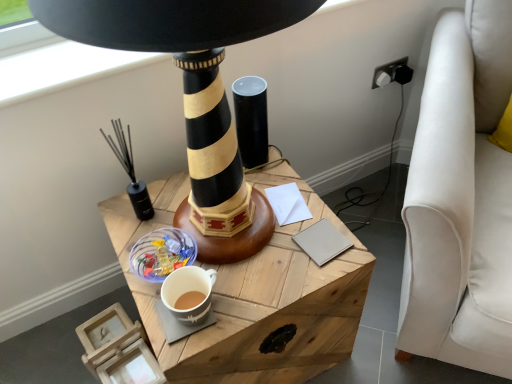
Describe the element at coordinates (392, 73) in the screenshot. I see `black plastic plug at upper right` at that location.

This screenshot has height=384, width=512. Describe the element at coordinates (193, 93) in the screenshot. I see `black matte lighthouse at center` at that location.

Image resolution: width=512 pixels, height=384 pixels. What are the coordinates of `matte black cylinder at center, which ranks as the first candle holder in right-to-left order` in the screenshot? It's located at (251, 120).

What do you see at coordinates (251, 120) in the screenshot?
I see `matte black cylinder at center, which is counted as the 2th candle holder, starting from the left` at bounding box center [251, 120].

Describe the element at coordinates (130, 172) in the screenshot. I see `black matte candle holder at left, which is the 2th candle holder from right to left` at that location.

Measure the distance between point (129, 169) and camera.

Point (129, 169) and camera are 3.30 feet apart from each other.

The image size is (512, 384). Describe the element at coordinates (322, 241) in the screenshot. I see `beige leather notepad at center, placed as the 1th notepad when sorted from front to back` at that location.

Based on the photo, what is the approximate width of wooden table at center?

The width of wooden table at center is 21.47 inches.

Locate an element on the screen. white leather swivel chair at right is located at coordinates (461, 198).

How far apart are matte ceramic mug at lower center and black matte lighthouse at center?

10.54 inches.

Which of these two, matte ceramic mug at lower center or black matte lighthouse at center, is wider?

black matte lighthouse at center is wider.

In the scene shown: Is matte ceramic mug at lower center placed right next to black matte lighthouse at center?

No, matte ceramic mug at lower center is not beside black matte lighthouse at center.

Who is smaller, matte ceramic mug at lower center or black matte lighthouse at center?

matte ceramic mug at lower center.

Is matte ceramic mug at lower center looking in the opposite direction of black plastic plug at upper right?

No, black plastic plug at upper right is not at the back of matte ceramic mug at lower center.

Considering their positions, is matte ceramic mug at lower center located in front of or behind black plastic plug at upper right?

matte ceramic mug at lower center is in front of black plastic plug at upper right.

Does matte ceramic mug at lower center appear on the right side of black plastic plug at upper right?

In fact, matte ceramic mug at lower center is to the left of black plastic plug at upper right.

Is matte ceramic mug at lower center far away from black plastic plug at upper right?

matte ceramic mug at lower center is positioned a significant distance from black plastic plug at upper right.

Can you confirm if matte black cylinder at center, which is counted as the 2th candle holder, starting from the left, is positioned to the right of white leather swivel chair at right?

In fact, matte black cylinder at center, which is counted as the 2th candle holder, starting from the left, is to the left of white leather swivel chair at right.

Is matte black cylinder at center, which is counted as the 2th candle holder, starting from the left, taller than white leather swivel chair at right?

No, matte black cylinder at center, which is counted as the 2th candle holder, starting from the left, is not taller than white leather swivel chair at right.

From the image's perspective, is matte black cylinder at center, which ranks as the first candle holder in right-to-left order, under white leather swivel chair at right?

Actually, matte black cylinder at center, which ranks as the first candle holder in right-to-left order, appears above white leather swivel chair at right in the image.

Does matte black cylinder at center, which is counted as the 2th candle holder, starting from the left, have a larger size compared to white leather swivel chair at right?

Actually, matte black cylinder at center, which is counted as the 2th candle holder, starting from the left, might be smaller than white leather swivel chair at right.

Would you say black plastic plug at upper right is outside wooden table at center?

That's correct, black plastic plug at upper right is outside of wooden table at center.

You are a GUI agent. You are given a task and a screenshot of the screen. Output one action in this format:
    pyautogui.click(x=<x>, y=<y>)
    Task: Click on the plug positioned vertically above the wooden table at center (from a real-world perspective)
    The height and width of the screenshot is (384, 512).
    Given the screenshot: What is the action you would take?
    pyautogui.click(x=392, y=73)

Between black plastic plug at upper right and wooden table at center, which one is positioned in front?

wooden table at center.

In the scene shown: Does beige leather notepad at center, the second notepad positioned from the back, have a lesser width compared to black plastic plug at upper right?

In fact, beige leather notepad at center, the second notepad positioned from the back, might be wider than black plastic plug at upper right.

From the image's perspective, which one is positioned higher, beige leather notepad at center, the second notepad positioned from the back, or black plastic plug at upper right?

black plastic plug at upper right is shown above in the image.

Can you tell me how much beige leather notepad at center, the second notepad positioned from the back, and black plastic plug at upper right differ in facing direction?

beige leather notepad at center, the second notepad positioned from the back, and black plastic plug at upper right are facing 12.9 degrees away from each other.

Locate an element on the screen. This screenshot has height=384, width=512. plug below the beige leather notepad at center, placed as the 1th notepad when sorted from front to back (from a real-world perspective) is located at coordinates (392, 73).

Would you consider matte black cylinder at center, which ranks as the first candle holder in right-to-left order, to be distant from black plastic plug at upper right?

matte black cylinder at center, which ranks as the first candle holder in right-to-left order, is actually quite close to black plastic plug at upper right.

Is matte black cylinder at center, which ranks as the first candle holder in right-to-left order, inside the boundaries of black plastic plug at upper right, or outside?

The correct answer is: outside.

Considering the relative sizes of matte black cylinder at center, which ranks as the first candle holder in right-to-left order, and black plastic plug at upper right in the image provided, is matte black cylinder at center, which ranks as the first candle holder in right-to-left order, smaller than black plastic plug at upper right?

Actually, matte black cylinder at center, which ranks as the first candle holder in right-to-left order, might be larger than black plastic plug at upper right.

Which of these two, matte black cylinder at center, which ranks as the first candle holder in right-to-left order, or black plastic plug at upper right, stands taller?

matte black cylinder at center, which ranks as the first candle holder in right-to-left order, is taller.

From the image's perspective, does matte ceramic mug at lower center appear higher than white paper at center, which ranks as the 2th notepad in front-to-back order?

Actually, matte ceramic mug at lower center appears below white paper at center, which ranks as the 2th notepad in front-to-back order, in the image.

How different are the orientations of matte ceramic mug at lower center and white paper at center, which is the 1th notepad from back to front, in degrees?

matte ceramic mug at lower center and white paper at center, which is the 1th notepad from back to front, are facing 2.41 degrees away from each other.

Who is bigger, matte ceramic mug at lower center or white paper at center, which ranks as the 2th notepad in front-to-back order?

With larger size is matte ceramic mug at lower center.

Considering the sizes of matte ceramic mug at lower center and white paper at center, which is the 1th notepad from back to front, in the image, is matte ceramic mug at lower center wider or thinner than white paper at center, which is the 1th notepad from back to front,?

In the image, matte ceramic mug at lower center appears to be more narrow than white paper at center, which is the 1th notepad from back to front.

Where is `coffee cup below the black matte lighthouse at center (from a real-world perspective)`? This screenshot has width=512, height=384. coffee cup below the black matte lighthouse at center (from a real-world perspective) is located at coordinates (188, 291).

Identify the location of coffee cup positioned vertically above the black plastic plug at upper right (from a real-world perspective). This screenshot has width=512, height=384. (188, 291).

Looking at the image, which one is located closer to wooden table at center, white leather swivel chair at right or matte ceramic mug at lower center?

matte ceramic mug at lower center is closer to wooden table at center.

Estimate the real-world distances between objects in this image. Which object is closer to white paper at center, which ranks as the 2th notepad in front-to-back order, white leather swivel chair at right or black plastic plug at upper right?

Based on the image, white leather swivel chair at right appears to be nearer to white paper at center, which ranks as the 2th notepad in front-to-back order.

When comparing their distances from black matte candle holder at left, which is the 1th candle holder in left-to-right order, does wooden table at center or beige leather notepad at center, placed as the 1th notepad when sorted from front to back, seem further?

beige leather notepad at center, placed as the 1th notepad when sorted from front to back.

Looking at the image, which one is located closer to black matte lighthouse at center, black matte candle holder at left, which is the 2th candle holder from right to left, or white paper at center, which ranks as the 2th notepad in front-to-back order?

black matte candle holder at left, which is the 2th candle holder from right to left, is closer to black matte lighthouse at center.

Considering their positions, is black plastic plug at upper right positioned further to wooden table at center than beige leather notepad at center, the second notepad positioned from the back?

black plastic plug at upper right.

Estimate the real-world distances between objects in this image. Which object is closer to matte ceramic mug at lower center, black matte candle holder at left, which is the 2th candle holder from right to left, or beige leather notepad at center, the second notepad positioned from the back?

beige leather notepad at center, the second notepad positioned from the back, lies closer to matte ceramic mug at lower center than the other object.

Looking at the image, which one is located further to black plastic plug at upper right, black matte lighthouse at center or white leather swivel chair at right?

Based on the image, black matte lighthouse at center appears to be further to black plastic plug at upper right.

From the image, which object appears to be nearer to black plastic plug at upper right, black matte lighthouse at center or matte black cylinder at center, which ranks as the first candle holder in right-to-left order?

matte black cylinder at center, which ranks as the first candle holder in right-to-left order, lies closer to black plastic plug at upper right than the other object.

At what (x,y) coordinates should I click in order to perform the action: click on notepad located between matte ceramic mug at lower center and beige leather notepad at center, placed as the 1th notepad when sorted from front to back, in the left-right direction. Please return your answer as a coordinate pair (x, y). The image size is (512, 384). Looking at the image, I should click on (288, 204).

Where is `table between matte ceramic mug at lower center and beige leather notepad at center, the second notepad positioned from the back, in the horizontal direction`? The image size is (512, 384). table between matte ceramic mug at lower center and beige leather notepad at center, the second notepad positioned from the back, in the horizontal direction is located at coordinates (254, 295).

Locate an element on the screen. This screenshot has height=384, width=512. candle holder between black matte candle holder at left, which is the 1th candle holder in left-to-right order, and white leather swivel chair at right, in the horizontal direction is located at coordinates (251, 120).

Identify the location of lamp situated between black matte candle holder at left, which is the 2th candle holder from right to left, and white leather swivel chair at right from left to right. This screenshot has width=512, height=384. (193, 93).